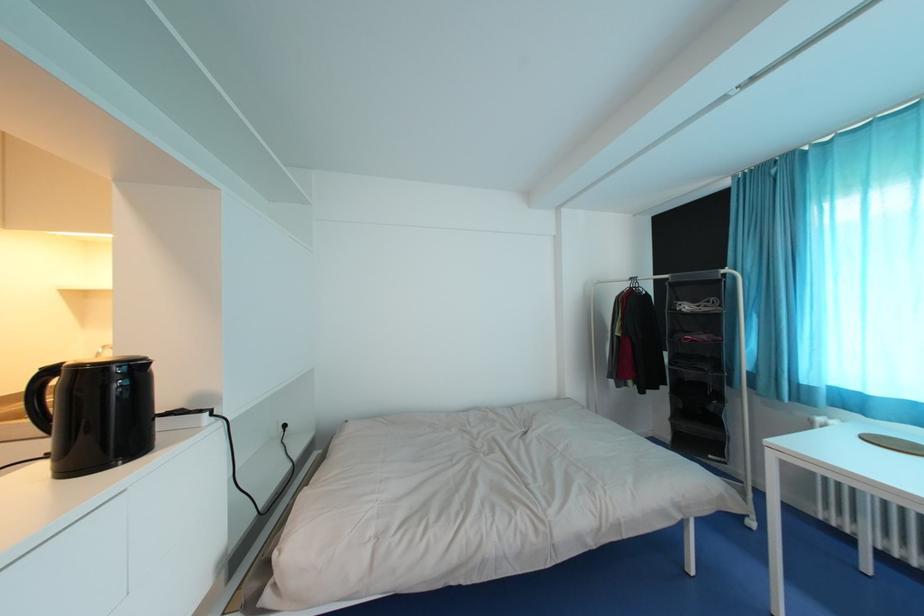
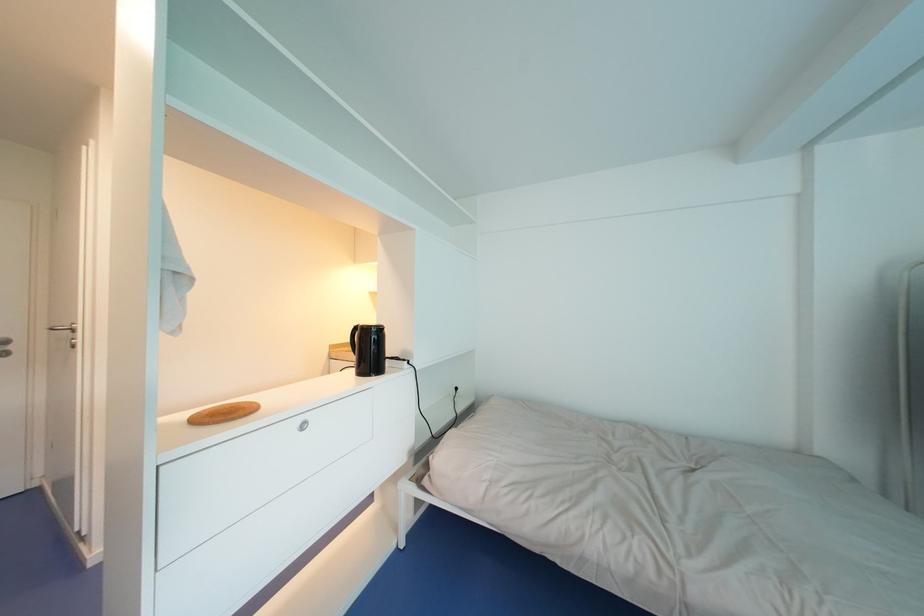
Question: How did the camera likely rotate?

Choices:
 (A) Left
 (B) Right
 (C) Up
 (D) Down

Answer: (A)